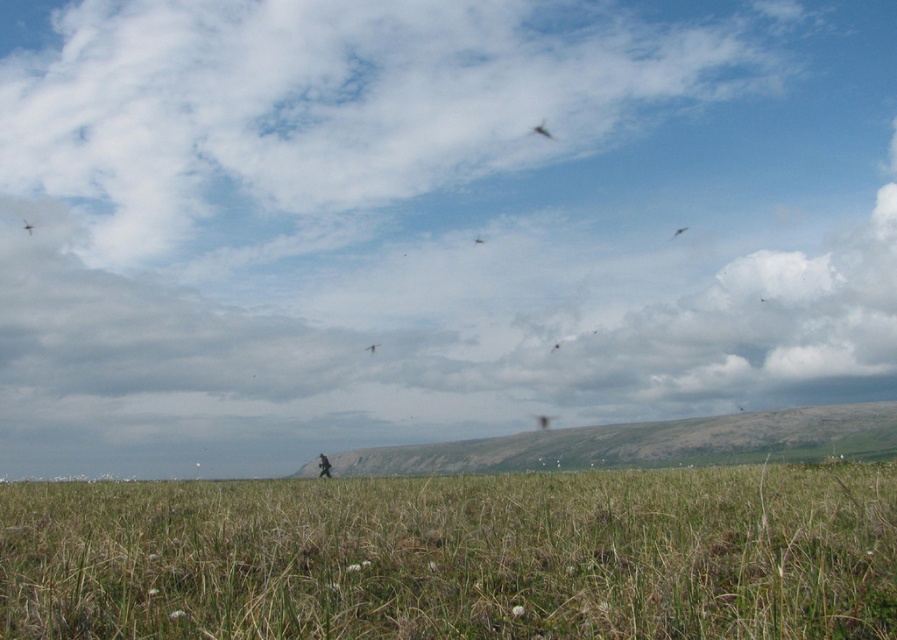
You are a photographer trying to capture the dark brown feathered bird at upper center in your shot. You want to ensure the green grass at lower center doesn not block the bird. Based on the scene, will the bird be visible in your photo?

The green grass at lower center is larger in size than the dark brown feathered bird at upper center, so the bird might be partially or fully obscured by the grass if they are in the same plane. However, since the bird is at upper center and the grass is at lower center, their positions might allow the bird to remain visible depending on the camera angle and focus.

You are standing in the grassy field and see two points marked in the image. The first point is at coordinates point [554,138] and the second is at point [477,243]. Which point is closer to you?

Point [554,138] is further to the camera than point [477,243], so the point closer to you is point [477,243].